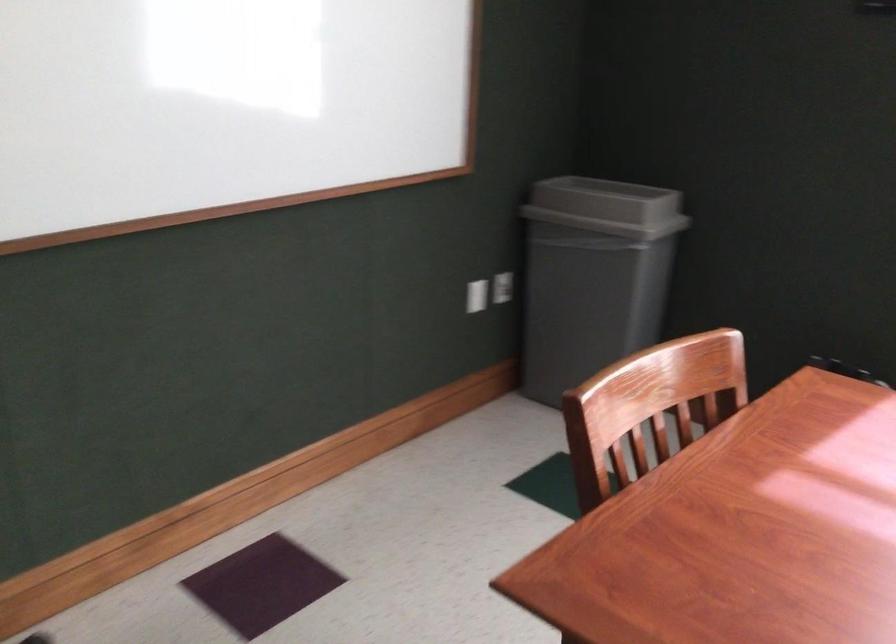
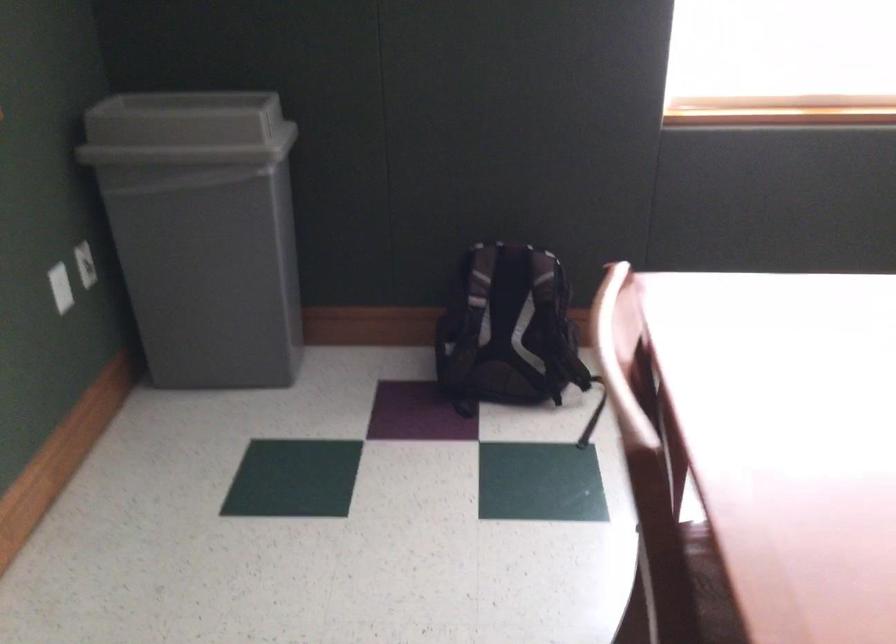
Question: The camera is either moving clockwise (left) or counter-clockwise (right) around the object. The first image is from the beginning of the video and the second image is from the end. Is the camera moving left or right when shooting the video?

Choices:
 (A) Left
 (B) Right

Answer: (A)